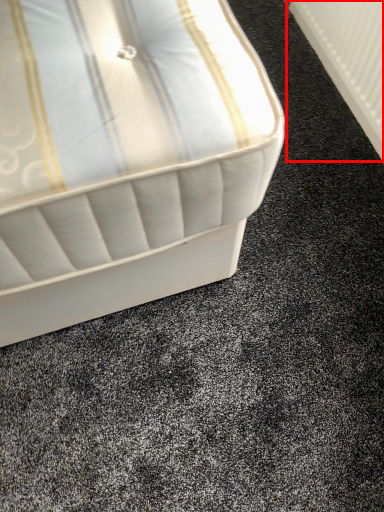
Question: From the image's perspective, what is the correct spatial relationship of radiator (annotated by the red box) in relation to bed?

Choices:
 (A) above
 (B) below

Answer: (A)